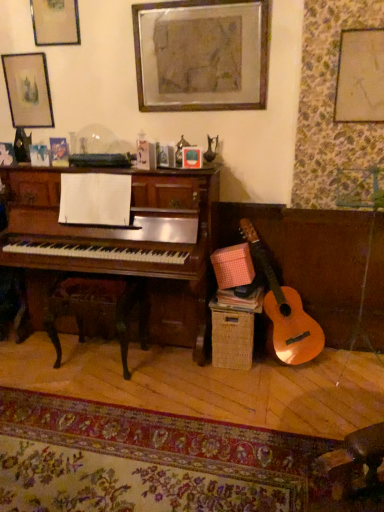
Question: From the image's perspective, relative to matte glass picture frame at upper center, arranged as the third picture frame when viewed from the right, is matte black picture frame at upper left, which appears as the 5th picture frame when viewed from the right, above or below?

Choices:
 (A) below
 (B) above

Answer: (B)

Question: Is point (26, 97) positioned closer to the camera than point (190, 167)?

Choices:
 (A) closer
 (B) farther

Answer: (B)

Question: Which object is the farthest from the matte glass picture frame at upper center, arranged as the third picture frame when viewed from the right?

Choices:
 (A) matte black picture frame at upper left, positioned as the 1th picture frame in left-to-right order
 (B) wooden rocking chair at lower left
 (C) matte gold picture frame at upper left, the 4th picture frame when ordered from right to left
 (D) wooden picture frame at upper center, marked as the 2th picture frame in a right-to-left arrangement
 (E) matte gold picture frame at upper right, which is counted as the first picture frame, starting from the right

Answer: (A)

Question: Which object is positioned farthest from the matte black picture frame at upper left, positioned as the 1th picture frame in left-to-right order?

Choices:
 (A) matte glass picture frame at upper center, which appears as the 3th picture frame when viewed from the left
 (B) matte gold picture frame at upper right, which is counted as the first picture frame, starting from the right
 (C) wooden picture frame at upper center, marked as the 2th picture frame in a right-to-left arrangement
 (D) wooden rocking chair at lower left
 (E) matte gold picture frame at upper left, the 4th picture frame when ordered from right to left

Answer: (B)